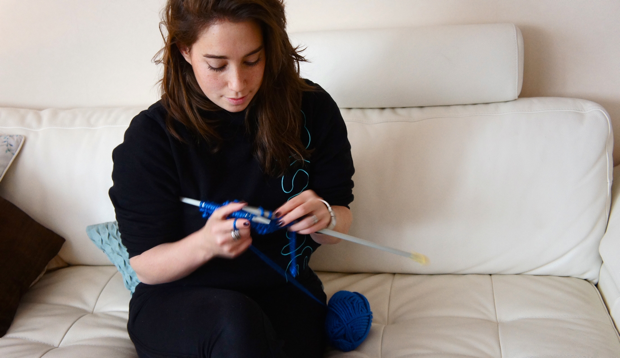
Where is `white neck pillow`? white neck pillow is located at coordinates (452, 59).